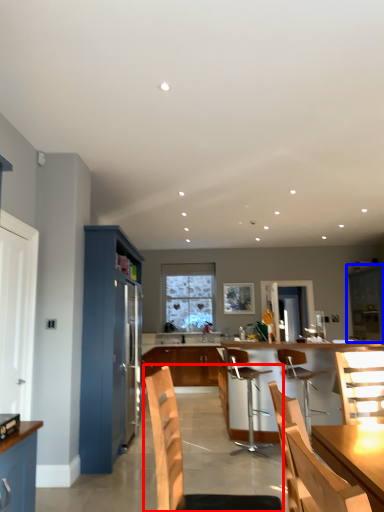
Question: Among these objects, which one is nearest to the camera, chair (highlighted by a red box) or cabinetry (highlighted by a blue box)?

Choices:
 (A) chair
 (B) cabinetry

Answer: (A)